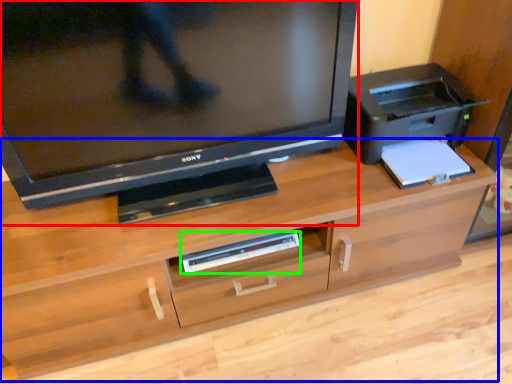
Question: Considering the real-world distances, which object is farthest from television (highlighted by a red box)? desk (highlighted by a blue box) or equipment (highlighted by a green box)?

Choices:
 (A) desk
 (B) equipment

Answer: (B)